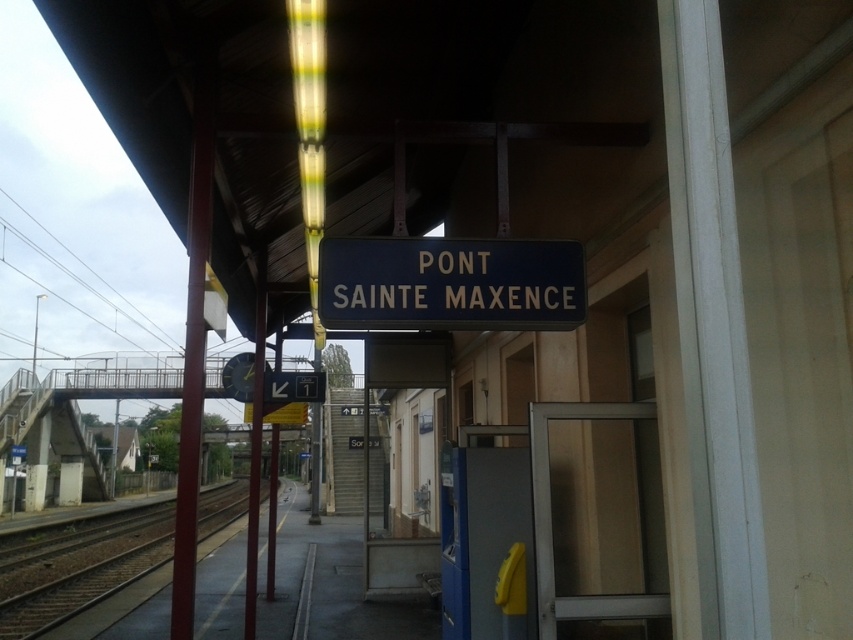
Question: Which of the following is the farthest from the observer?

Choices:
 (A) brown wooden train track at lower left
 (B) blue metallic sign at center

Answer: (A)

Question: Does blue metallic sign at center appear over brown wooden train track at lower left?

Choices:
 (A) no
 (B) yes

Answer: (B)

Question: Can you confirm if blue metallic sign at center is positioned to the left of brown wooden train track at lower left?

Choices:
 (A) yes
 (B) no

Answer: (B)

Question: Can you confirm if blue metallic sign at center is positioned to the right of brown wooden train track at lower left?

Choices:
 (A) no
 (B) yes

Answer: (B)

Question: Which object is closer to the camera taking this photo?

Choices:
 (A) brown wooden train track at lower left
 (B) blue metallic sign at center

Answer: (B)